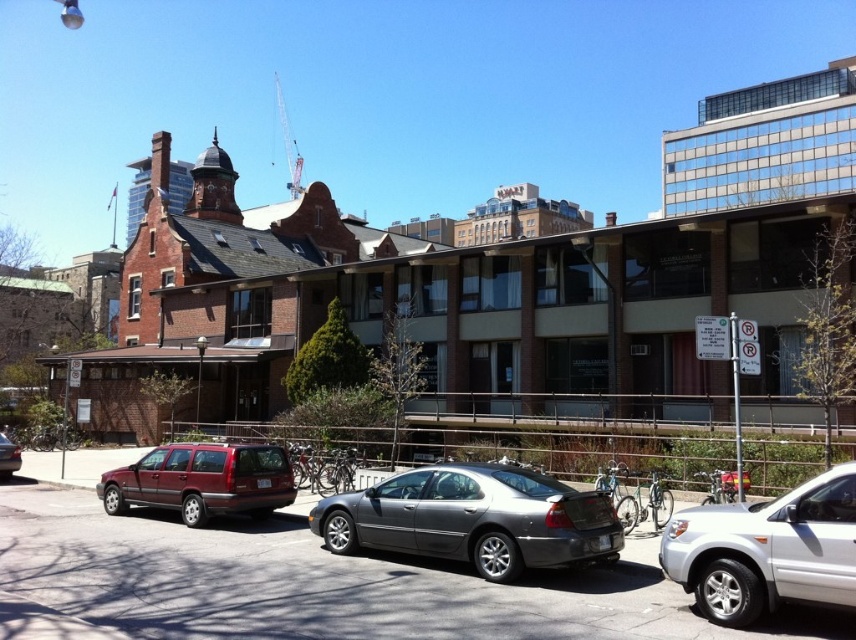
You are a delivery driver who needs to park your truck between the metallic gray sedan at center and the white matte suv at lower right. Your truck is 2 meters wide. Can you fit your truck in the space between them?

The metallic gray sedan at center might be wider than white matte suv at lower right, so the space between them may not be wide enough for your 2 meter wide truck. You should check the exact width before attempting to park.

You are a delivery driver who needs to park your truck, which is 5 meters long, in this urban street scene. The parking spot available is between the metallic gray sedan at center and the white matte suv at lower right. Can your truck fit in this space?

The metallic gray sedan at center is bigger than the white matte suv at lower right, but the description does not provide the exact length of either vehicle. Without knowing the combined length of the space between them, it is impossible to determine if the 5 meter truck will fit.

You are a delivery person who needs to park your metallic gray sedan at center in a specific spot. The parking spot is located at coordinates point 0.908, 0.356. Can you confirm if your car is already parked in the correct spot?

Yes, the metallic gray sedan at center is already parked at point [304,580], so it is in the correct spot.